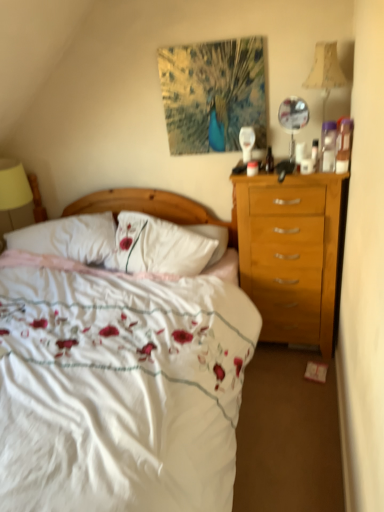
Question: Is beige fabric lampshade at upper right thinner than white soft pillow at center?

Choices:
 (A) yes
 (B) no

Answer: (A)

Question: Is beige fabric lampshade at upper right outside of white soft pillow at center?

Choices:
 (A) yes
 (B) no

Answer: (A)

Question: Considering the relative sizes of beige fabric lampshade at upper right and white soft pillow at center in the image provided, is beige fabric lampshade at upper right wider than white soft pillow at center?

Choices:
 (A) no
 (B) yes

Answer: (A)

Question: From a real-world perspective, is beige fabric lampshade at upper right on top of white soft pillow at center?

Choices:
 (A) yes
 (B) no

Answer: (A)

Question: Does beige fabric lampshade at upper right appear on the right side of white soft pillow at center?

Choices:
 (A) no
 (B) yes

Answer: (B)

Question: From the image's perspective, relative to white soft pillow at center, is white floral duvet at center above or below?

Choices:
 (A) below
 (B) above

Answer: (A)

Question: Is white floral duvet at center taller or shorter than white soft pillow at center?

Choices:
 (A) tall
 (B) short

Answer: (A)

Question: Considering the positions of white floral duvet at center and white soft pillow at center in the image, is white floral duvet at center bigger or smaller than white soft pillow at center?

Choices:
 (A) small
 (B) big

Answer: (B)

Question: Is point (142, 506) closer or farther from the camera than point (61, 244)?

Choices:
 (A) farther
 (B) closer

Answer: (B)

Question: Considering their positions, is beige fabric lampshade at upper right located in front of or behind wooden headboard at center?

Choices:
 (A) behind
 (B) front

Answer: (B)

Question: Which is correct: beige fabric lampshade at upper right is inside wooden headboard at center, or outside of it?

Choices:
 (A) inside
 (B) outside

Answer: (B)

Question: In terms of size, does beige fabric lampshade at upper right appear bigger or smaller than wooden headboard at center?

Choices:
 (A) small
 (B) big

Answer: (A)

Question: From the image's perspective, is beige fabric lampshade at upper right positioned above or below wooden headboard at center?

Choices:
 (A) above
 (B) below

Answer: (A)

Question: Considering the positions of white soft pillow at center and white floral duvet at center in the image, is white soft pillow at center wider or thinner than white floral duvet at center?

Choices:
 (A) thin
 (B) wide

Answer: (A)

Question: In the image, is white soft pillow at center positioned in front of or behind white floral duvet at center?

Choices:
 (A) behind
 (B) front

Answer: (A)